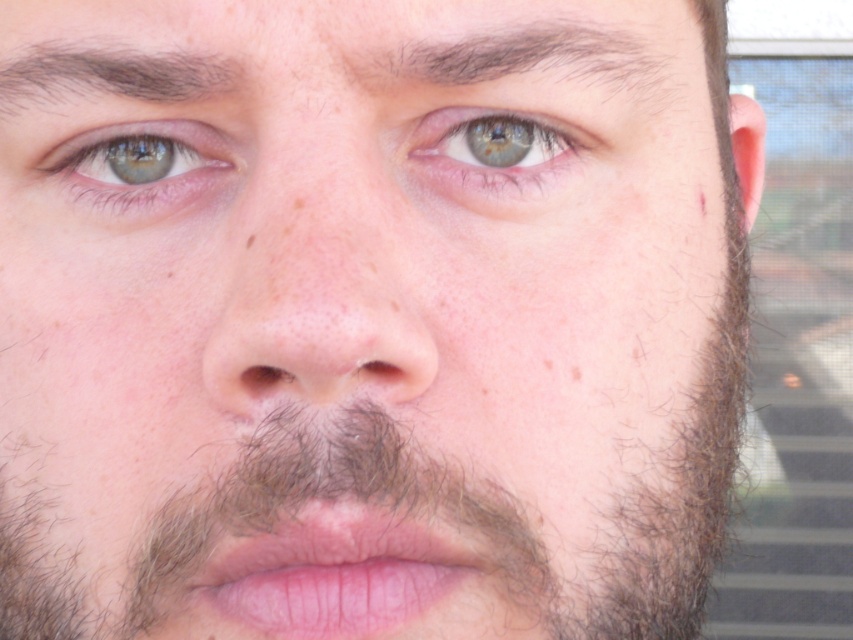
Based on the scene description, which object is bigger between the smooth skin nose at center and the dark brown hair at upper left?

The smooth skin nose at center is larger in size than the dark brown hair at upper left.

You are a barber trying to style the dark brown hair at upper center and the dark brown hair at upper left. Which hair section should you adjust first if you want to create a balanced look?

The dark brown hair at upper center has a greater height compared to dark brown hair at upper left, so you should first lower the height of the dark brown hair at upper center to match the dark brown hair at upper left for balance.

You are a photographer adjusting the focus of your camera. You want to ensure that the dark brown hair at upper center is in sharp focus while keeping the background slightly blurred. Based on the distance provided, can you confirm if the camera is set to a shallow depth of field?

The dark brown hair at upper center is 36.63 centimeters from the camera. To have it in sharp focus with a blurred background, a shallow depth of field is appropriate since it limits the area in focus to the subject at that distance, allowing the background to blur.